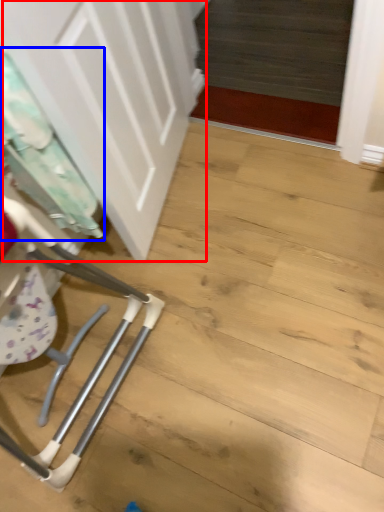
Question: Among these objects, which one is farthest to the camera, door (highlighted by a red box) or laundry (highlighted by a blue box)?

Choices:
 (A) door
 (B) laundry

Answer: (B)